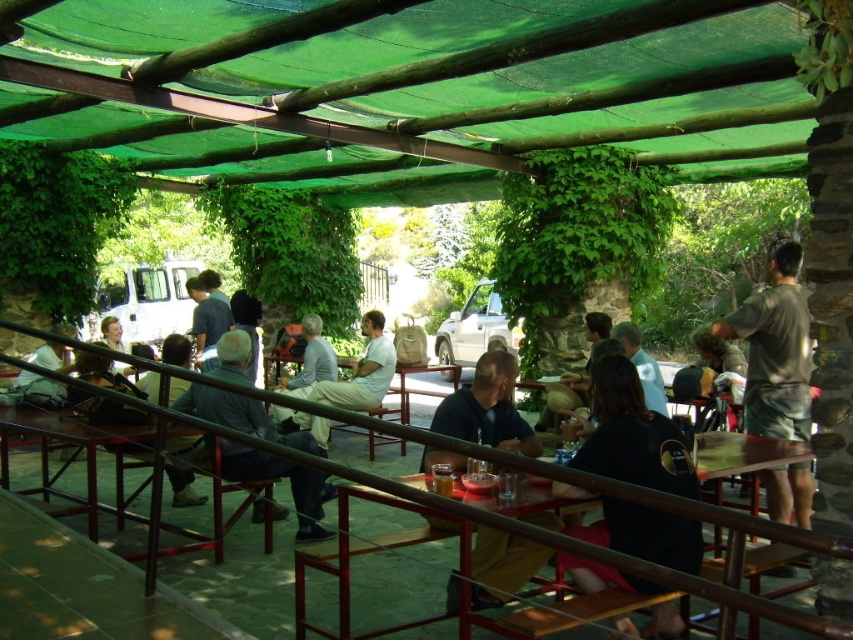
Question: Which object appears closest to the camera in this image?

Choices:
 (A) matte brown bag at center
 (B) light brown leather jacket at center
 (C) black fabric shirt at center

Answer: (C)

Question: Can you confirm if dark blue shirt at center is bigger than light brown leather jacket at center?

Choices:
 (A) yes
 (B) no

Answer: (B)

Question: Is metallic red table at center thinner than blue striped shirt at center?

Choices:
 (A) no
 (B) yes

Answer: (A)

Question: Is the position of matte blue shirt at center less distant than that of matte gray backpack at center?

Choices:
 (A) no
 (B) yes

Answer: (B)

Question: Which object is positioned closest to the wooden table at lower left?

Choices:
 (A) light brown leather jacket at center
 (B) green fabric canopy at upper center
 (C) blue striped shirt at center
 (D) matte black backpack at left

Answer: (C)

Question: Which object is positioned closest to the matte black backpack at left?

Choices:
 (A) metallic red table at center
 (B) black fabric shirt at center
 (C) matte blue shirt at center

Answer: (A)